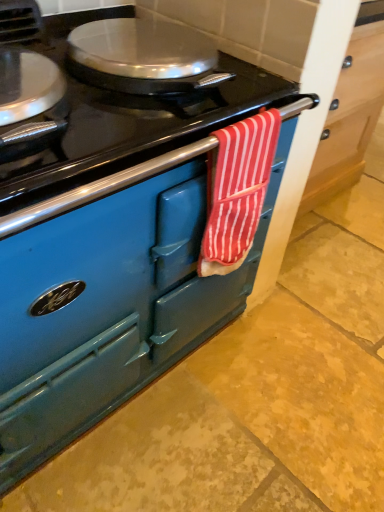
Question: From the image's perspective, is red striped towel at center located above or below matte blue oven at center?

Choices:
 (A) below
 (B) above

Answer: (B)

Question: Is red striped towel at center bigger or smaller than matte blue oven at center?

Choices:
 (A) small
 (B) big

Answer: (A)

Question: Would you say red striped towel at center is to the left or to the right of matte blue oven at center in the picture?

Choices:
 (A) left
 (B) right

Answer: (A)

Question: Choose the correct answer: Is matte blue oven at center inside red striped towel at center or outside it?

Choices:
 (A) inside
 (B) outside

Answer: (B)

Question: From their relative heights in the image, would you say matte blue oven at center is taller or shorter than red striped towel at center?

Choices:
 (A) short
 (B) tall

Answer: (A)

Question: Is matte blue oven at center bigger or smaller than red striped towel at center?

Choices:
 (A) big
 (B) small

Answer: (A)

Question: From a real-world perspective, relative to red striped towel at center, is matte blue oven at center vertically above or below?

Choices:
 (A) below
 (B) above

Answer: (A)